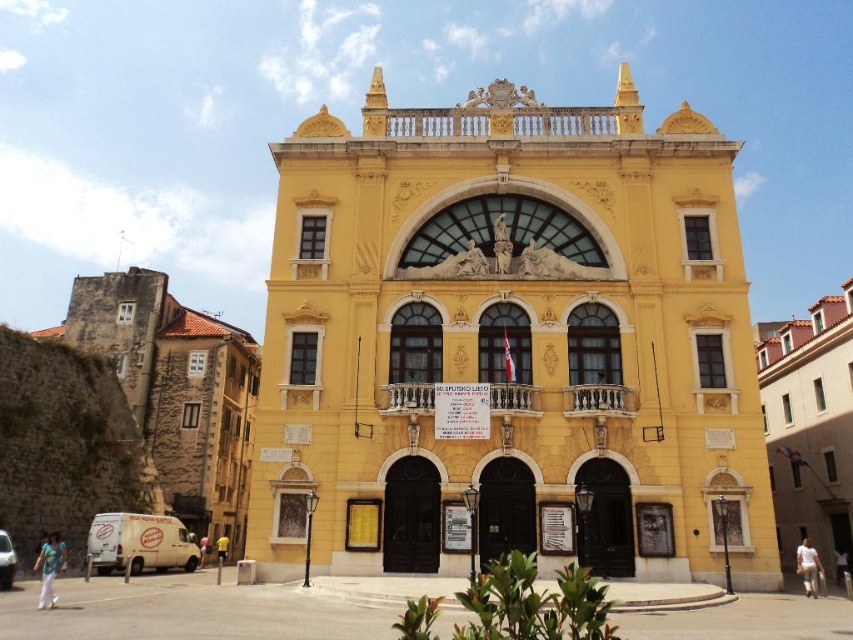
Does yellow matte building at center have a lesser height compared to yellow matte building at right?

In fact, yellow matte building at center may be taller than yellow matte building at right.

Does yellow matte building at center appear over yellow matte building at right?

Correct, yellow matte building at center is located above yellow matte building at right.

Does point (402, 342) come in front of point (828, 572)?

Yes, point (402, 342) is in front of point (828, 572).

The width and height of the screenshot is (853, 640). In order to click on yellow matte building at center in this screenshot , I will do `click(508, 339)`.

The image size is (853, 640). What do you see at coordinates (49, 568) in the screenshot?
I see `light blue fabric shirt at lower left` at bounding box center [49, 568].

Which is below, light blue fabric shirt at lower left or white cotton shirt at lower right?

white cotton shirt at lower right is lower down.

At what (x,y) coordinates should I click in order to perform the action: click on light blue fabric shirt at lower left. Please return your answer as a coordinate pair (x, y). This screenshot has width=853, height=640. Looking at the image, I should click on (x=49, y=568).

Locate an element on the screen. The image size is (853, 640). light blue fabric shirt at lower left is located at coordinates (49, 568).

Consider the image. Does yellow matte building at center come behind brown stone wall at left?

No, it is in front of brown stone wall at left.

Between yellow matte building at center and brown stone wall at left, which one appears on the left side from the viewer's perspective?

Positioned to the left is brown stone wall at left.

Between point (650, 461) and point (210, 372), which one is positioned in front?

Point (650, 461) is in front.

This screenshot has height=640, width=853. I want to click on yellow matte building at center, so click(x=508, y=339).